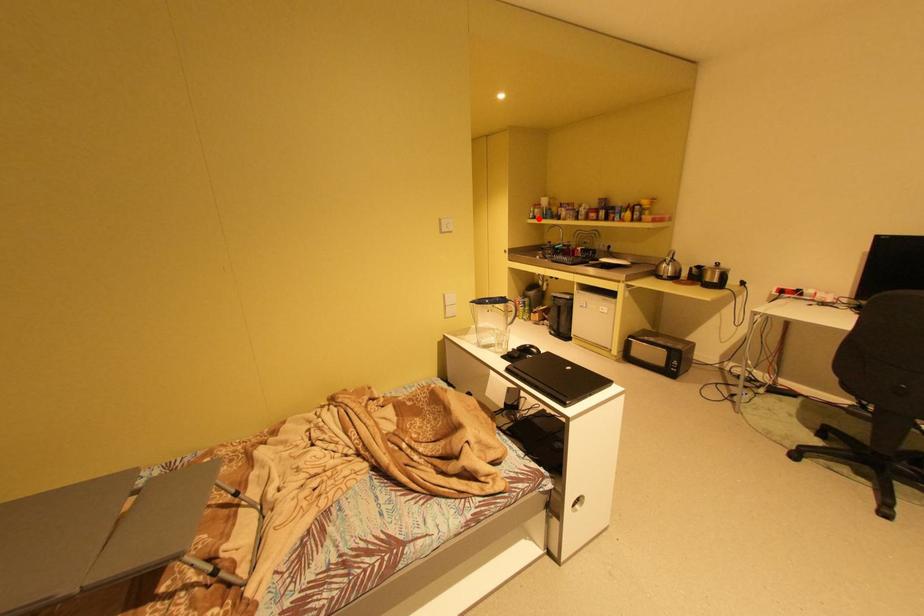
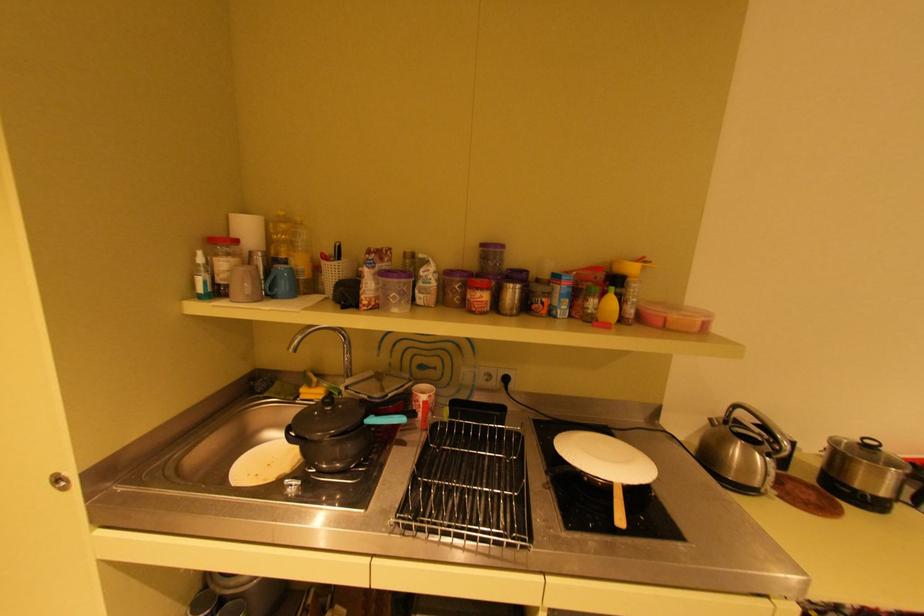
Question: I am providing you with two images of the same scene from different viewpoints. Image1 has a red point marked. In image2, the corresponding 3D location appears at what relative position? Reply with the corresponding letter.

Choices:
 (A) Closer
 (B) Farther

Answer: (B)